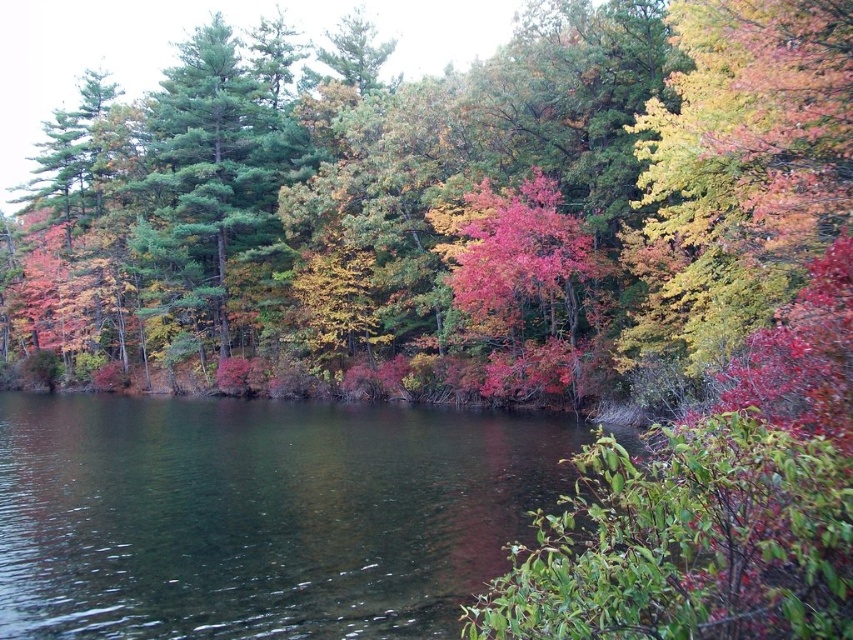
Question: Does clear water at center appear under green matte tree at upper left?

Choices:
 (A) no
 (B) yes

Answer: (B)

Question: Which point is farther to the camera?

Choices:
 (A) (171, 140)
 (B) (125, 561)

Answer: (A)

Question: Which point is farther to the camera?

Choices:
 (A) green matte tree at upper left
 (B) clear water at center

Answer: (A)

Question: Can you confirm if clear water at center is positioned below green matte tree at upper left?

Choices:
 (A) no
 (B) yes

Answer: (B)

Question: Is clear water at center above green matte tree at upper left?

Choices:
 (A) yes
 (B) no

Answer: (B)

Question: Which point is closer to the camera?

Choices:
 (A) clear water at center
 (B) green matte tree at upper left

Answer: (A)